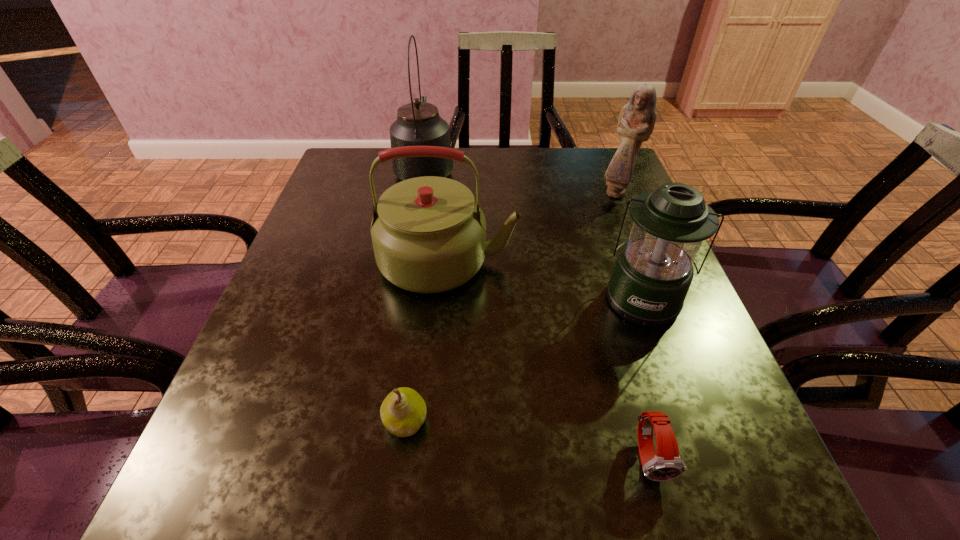
The width and height of the screenshot is (960, 540). I want to click on vacant space located 0.050m on the back of the pear, so (x=412, y=374).

The height and width of the screenshot is (540, 960). I want to click on free location located 0.060m on the face of the watch, so click(x=671, y=535).

The width and height of the screenshot is (960, 540). I want to click on kettle that is at the far edge, so click(418, 123).

Find the location of `figurine present at the far edge`. figurine present at the far edge is located at coordinates coord(636,122).

At what (x,y) coordinates should I click in order to perform the action: click on object located in the near edge section of the desktop. Please return your answer as a coordinate pair (x, y). Looking at the image, I should click on (667, 465).

Identify the location of figurine present at the right edge. The width and height of the screenshot is (960, 540). (636, 122).

At what (x,y) coordinates should I click in order to perform the action: click on lantern located at the right edge. Please return your answer as a coordinate pair (x, y). Looking at the image, I should click on (653, 273).

Identify the location of watch situated at the right edge. (667, 465).

At what (x,y) coordinates should I click in order to perform the action: click on object positioned at the far right corner. Please return your answer as a coordinate pair (x, y). Image resolution: width=960 pixels, height=540 pixels. Looking at the image, I should click on (636, 122).

I want to click on object positioned at the near right corner, so click(x=667, y=465).